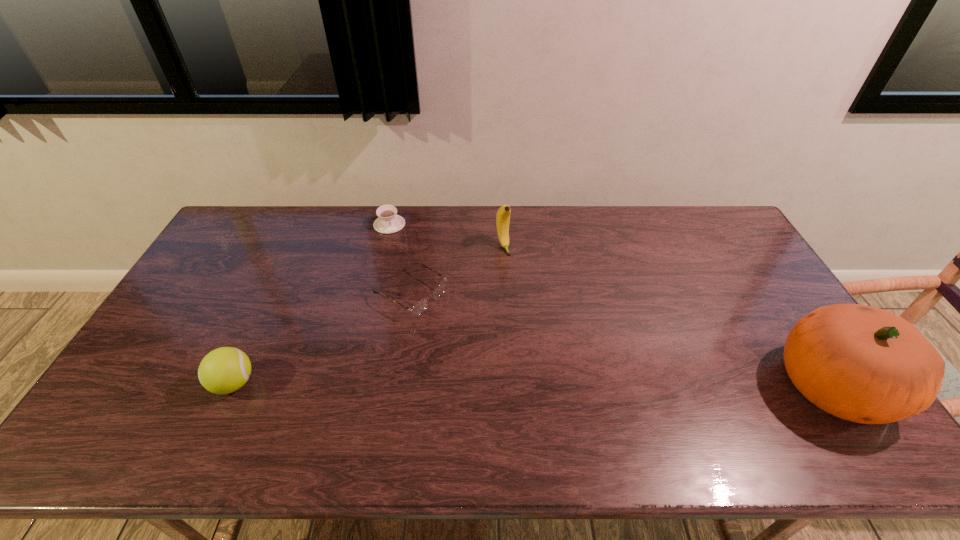
This screenshot has width=960, height=540. What are the coordinates of `free location located on the front-facing side of the spectacles` in the screenshot? It's located at (481, 335).

At what (x,y) coordinates should I click in order to perform the action: click on free region located 0.330m on the front-facing side of the spectacles. Please return your answer as a coordinate pair (x, y). Looking at the image, I should click on (531, 366).

Where is `vacant space situated from the stem of the banana`? vacant space situated from the stem of the banana is located at coordinates (528, 300).

Identify the location of free spot located 0.120m from the stem of the banana. The image size is (960, 540). (517, 279).

The width and height of the screenshot is (960, 540). I want to click on free space located from the stem of the banana, so click(549, 342).

Identify the location of vacant space situated 0.070m on the handle side of the farthest object. (396, 245).

You are a GUI agent. You are given a task and a screenshot of the screen. Output one action in this format:
    pyautogui.click(x=<x>, y=<y>)
    Task: Click on the vacant space situated on the handle side of the farthest object
    The width and height of the screenshot is (960, 540).
    Given the screenshot: What is the action you would take?
    pyautogui.click(x=404, y=267)

Identify the location of vacant space located on the handle side of the farthest object. This screenshot has width=960, height=540. (405, 269).

The width and height of the screenshot is (960, 540). Find the location of `banana situated at the far edge`. banana situated at the far edge is located at coordinates (503, 214).

At what (x,y) coordinates should I click in order to perform the action: click on teacup present at the far edge. Please return your answer as a coordinate pair (x, y). This screenshot has width=960, height=540. Looking at the image, I should click on (388, 222).